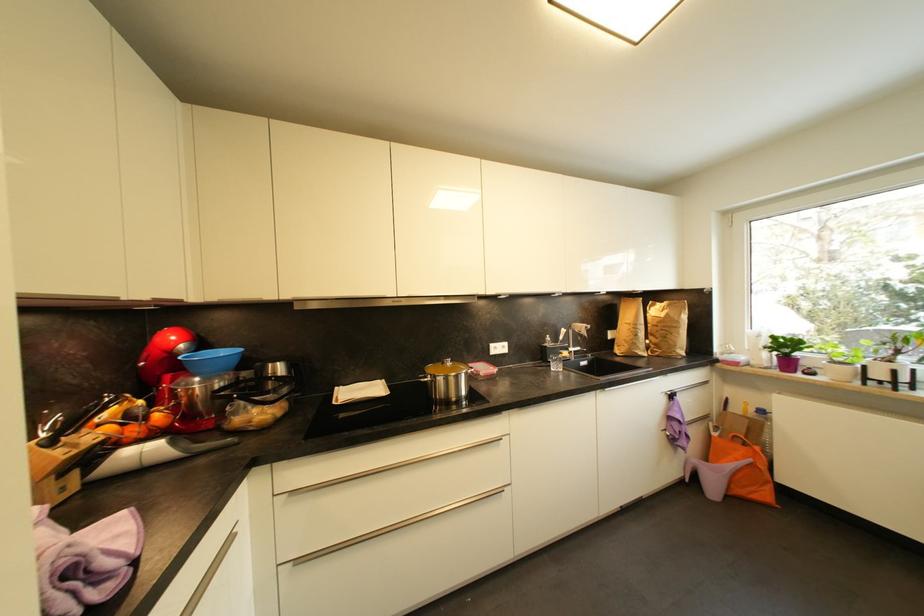
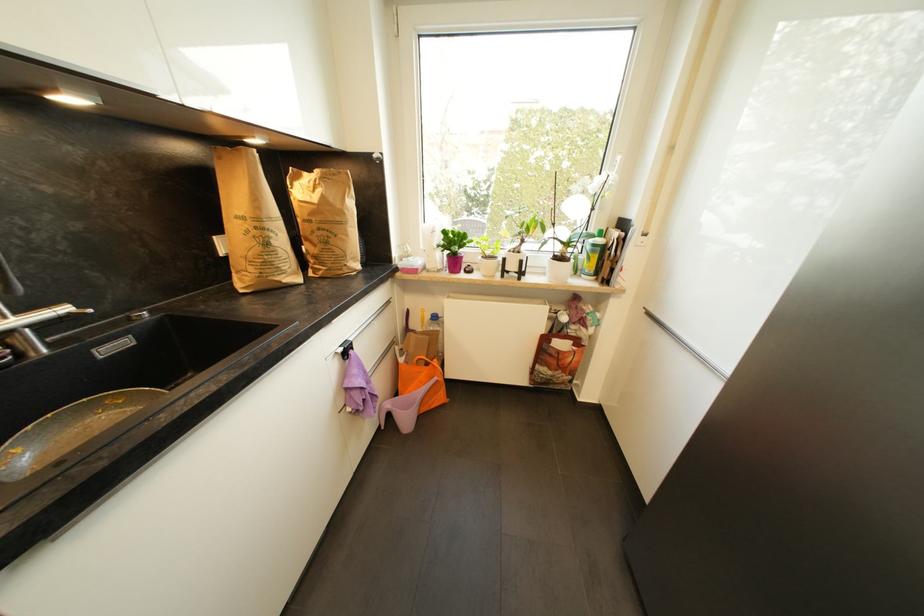
The point at [663,323] is marked in the first image. Where is the corresponding point in the second image?

(317, 216)